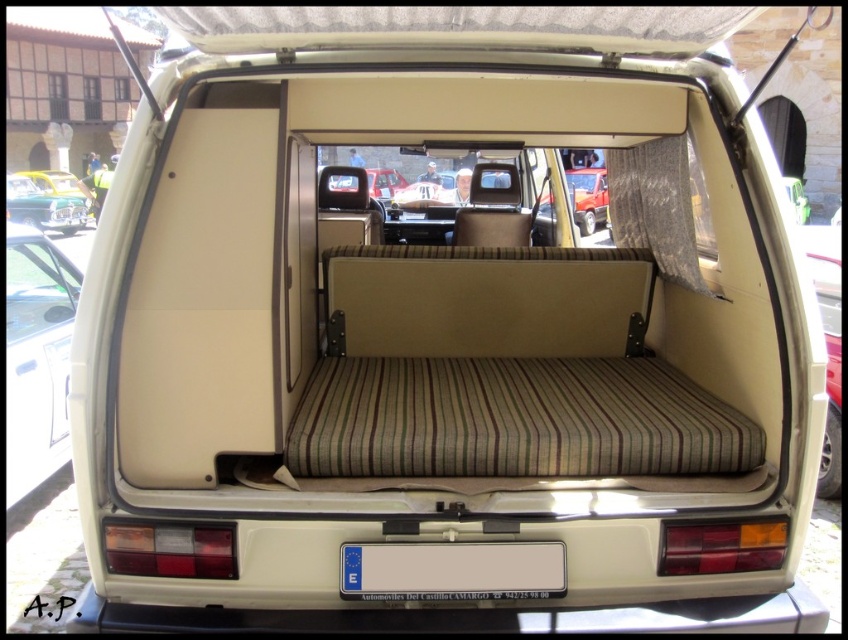
You are a delivery person who needs to attach a rectangular package to the van. The package must be placed between the white plastic license plate at center and the shiny green car at upper left. Considering their sizes, will the package fit vertically between them?

The white plastic license plate at center is not as tall as the shiny green car at upper left, so the vertical space between them may be sufficient to fit the package, but the exact dimensions of the package are needed to confirm.

You are standing in the driver seat of the vintage van and want to check both the white matte car at left and the shiny green car at upper left. Which car will appear larger in your view?

The white matte car at left appears larger because it is closer to the viewer than the shiny green car at upper left.